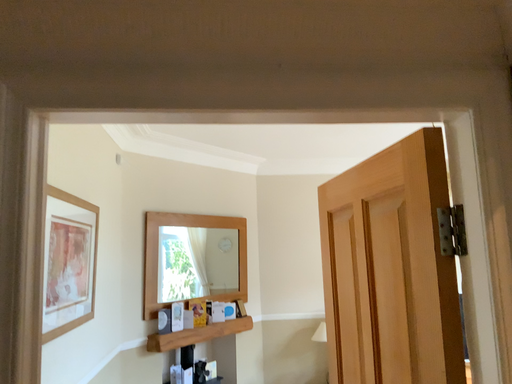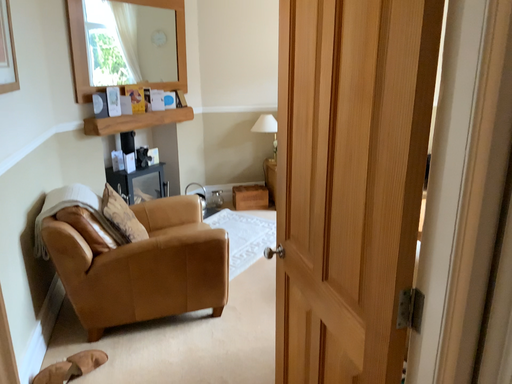
Question: How did the camera likely rotate when shooting the video?

Choices:
 (A) rotated downward
 (B) rotated upward

Answer: (A)